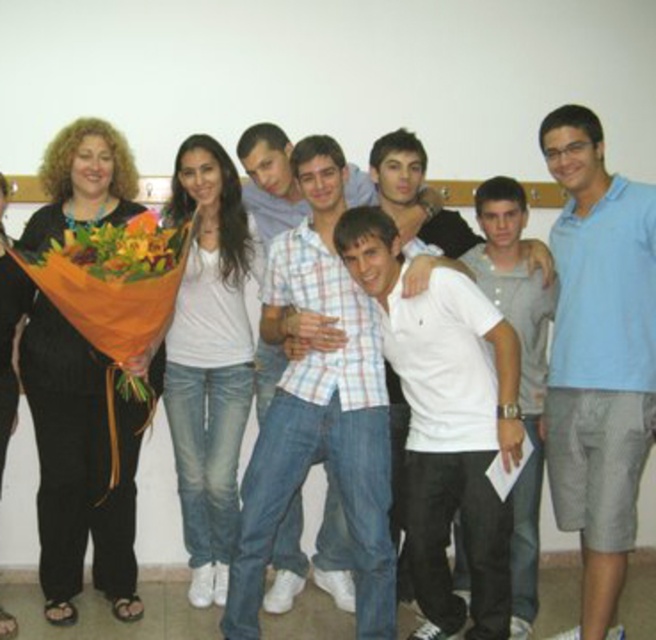
Is light blue polo shirt at right bigger than plaid shirt at center?

Actually, light blue polo shirt at right might be smaller than plaid shirt at center.

Is point (623, 499) positioned in front of point (338, 406)?

Yes, it is.

Where is `light blue polo shirt at right`? The width and height of the screenshot is (656, 640). light blue polo shirt at right is located at coordinates coord(598,356).

Locate an element on the screen. light blue polo shirt at right is located at coordinates (598, 356).

Can you confirm if plaid shirt at center is positioned above orange paper wrapped bouquet at left?

Incorrect, plaid shirt at center is not positioned above orange paper wrapped bouquet at left.

Does plaid shirt at center appear on the right side of orange paper wrapped bouquet at left?

Indeed, plaid shirt at center is positioned on the right side of orange paper wrapped bouquet at left.

The width and height of the screenshot is (656, 640). Find the location of `plaid shirt at center`. plaid shirt at center is located at coordinates (319, 406).

The image size is (656, 640). I want to click on plaid shirt at center, so click(319, 406).

Is plaid shirt at center wider than vibrant floral bouquet at left?

Indeed, plaid shirt at center has a greater width compared to vibrant floral bouquet at left.

I want to click on plaid shirt at center, so click(319, 406).

I want to click on plaid shirt at center, so click(x=319, y=406).

The height and width of the screenshot is (640, 656). Find the location of `plaid shirt at center`. plaid shirt at center is located at coordinates (319, 406).